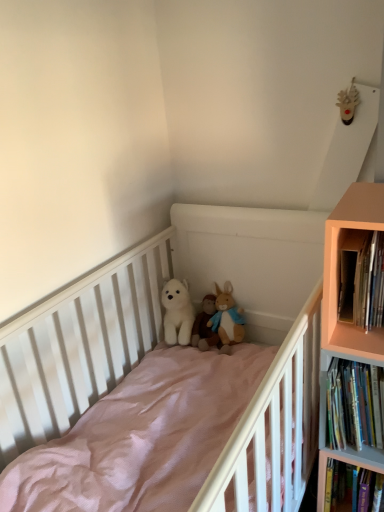
Question: In the image, is white plush bear at center, arranged as the 1th toy when viewed from the left, positioned in front of or behind white plush bear at center, the 2th toy viewed from the right?

Choices:
 (A) behind
 (B) front

Answer: (B)

Question: Looking at the image, does white plush bear at center, arranged as the 1th toy when viewed from the left, seem bigger or smaller compared to white plush bear at center, marked as the second toy in a left-to-right arrangement?

Choices:
 (A) big
 (B) small

Answer: (A)

Question: Based on their relative distances, which object is nearer to the white plush bear at center, marked as the second toy in a left-to-right arrangement?

Choices:
 (A) pale orange wood bookcase at right
 (B) fluffy white stuffed animal at center, the third toy viewed from the left
 (C) white plush bear at center, arranged as the 1th toy when viewed from the left
 (D) hardcover books at right, placed as the first book when sorted from top to bottom
 (E) hardcover books at right, the second book when ordered from top to bottom

Answer: (B)

Question: Which object is positioned closest to the fluffy white stuffed animal at center, positioned as the first toy in right-to-left order?

Choices:
 (A) hardcover books at right, placed as the first book when sorted from top to bottom
 (B) white matte crib at center
 (C) white plush bear at center, arranged as the 1th toy when viewed from the left
 (D) pale orange wood bookcase at right
 (E) white plush bear at center, marked as the second toy in a left-to-right arrangement

Answer: (C)